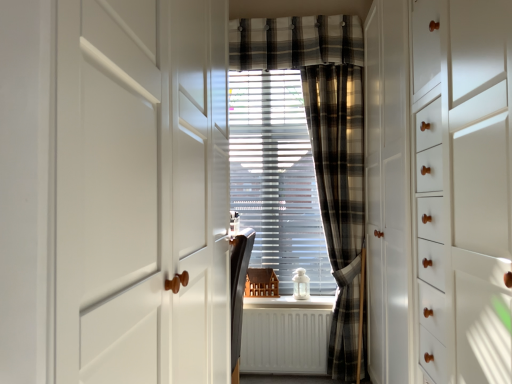
Where is `vacant point above plaid fabric curtain at center (from a real-world perspective)`? vacant point above plaid fabric curtain at center (from a real-world perspective) is located at coordinates (294, 24).